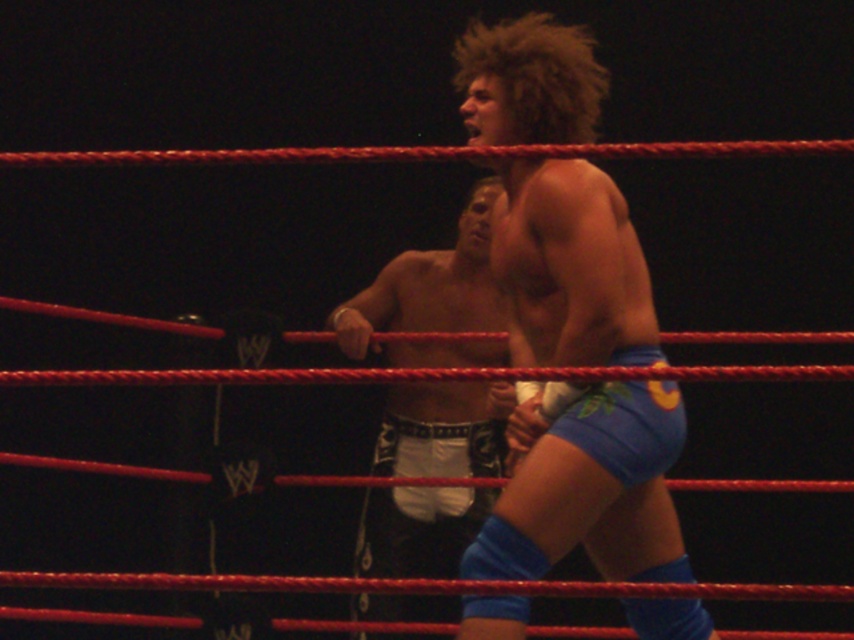
Does blue fabric shorts at center come in front of white fabric shorts at center?

Yes, it is.

Can you confirm if blue fabric shorts at center is smaller than white fabric shorts at center?

Correct, blue fabric shorts at center occupies less space than white fabric shorts at center.

Is point (600, 74) farther from viewer compared to point (407, 428)?

No.

The width and height of the screenshot is (854, 640). What are the coordinates of `blue fabric shorts at center` in the screenshot? It's located at pos(592,492).